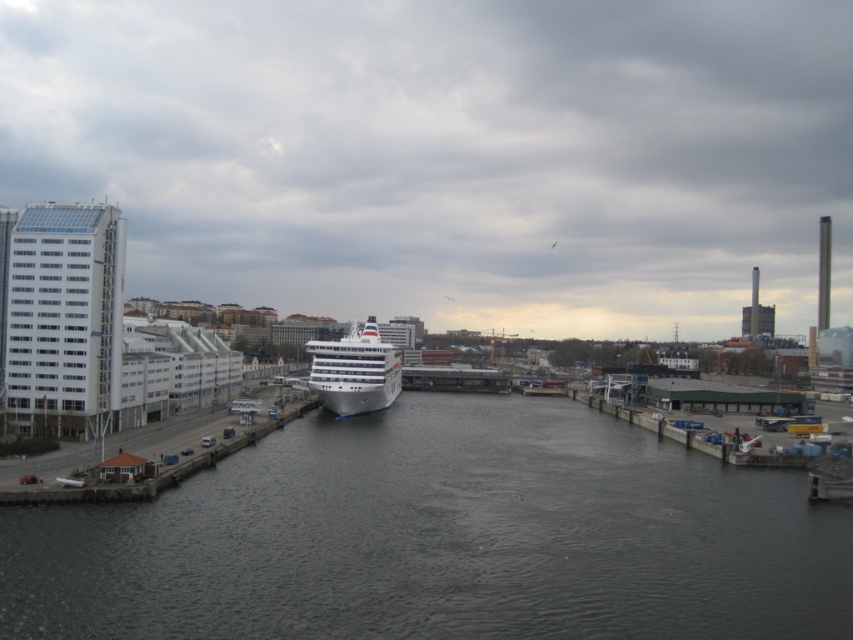
You are a photographer standing on the dock and want to capture both the dark gray water at center and the white glossy cruise ship at center in a single shot. Based on their positions, which object should you position closer to the left side of your camera frame?

The white glossy cruise ship at center should be positioned closer to the left side of your camera frame because the dark gray water at center is located to its right.

You are standing at the point marked by the coordinates point [440,538] in the harbor scene. What is the immediate surface you are standing on?

The dark gray water at center is represented by point [440,538], so you are standing on the dark gray water at center.

Based on the photo, you are a photographer standing at the edge of the harbor, and you want to take a photo that includes both the cruise ship and the modern building. You notice two points marked in the scene. Which point, point (229, 573) or point (393, 349), is closer to your current position?

Point (229, 573) is closer to the camera than point (393, 349), so it is closer to your current position.